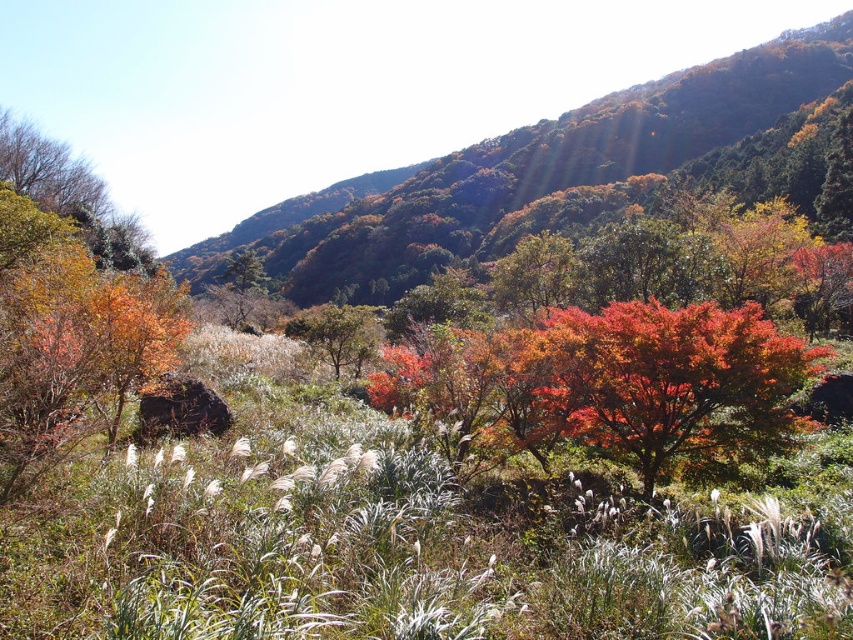
Does autumn foliage at upper center appear on the left side of vivid red leaves at center?

Correct, you'll find autumn foliage at upper center to the left of vivid red leaves at center.

Does autumn foliage at upper center appear over vivid red leaves at center?

Yes.

Who is more forward, [341,259] or [753,428]?

Positioned in front is point [753,428].

Locate an element on the screen. The width and height of the screenshot is (853, 640). autumn foliage at upper center is located at coordinates (520, 172).

Can you confirm if vivid red leaves at center is bigger than green matte tree at center?

No.

Where is `vivid red leaves at center`? The width and height of the screenshot is (853, 640). vivid red leaves at center is located at coordinates (606, 381).

Can you confirm if autumn foliage at upper center is wider than green matte tree at center?

Indeed, autumn foliage at upper center has a greater width compared to green matte tree at center.

Can you confirm if autumn foliage at upper center is smaller than green matte tree at center?

Incorrect, autumn foliage at upper center is not smaller in size than green matte tree at center.

Is point (631, 172) closer to camera compared to point (331, 314)?

No, it is behind (331, 314).

Locate an element on the screen. The image size is (853, 640). autumn foliage at upper center is located at coordinates coord(520,172).